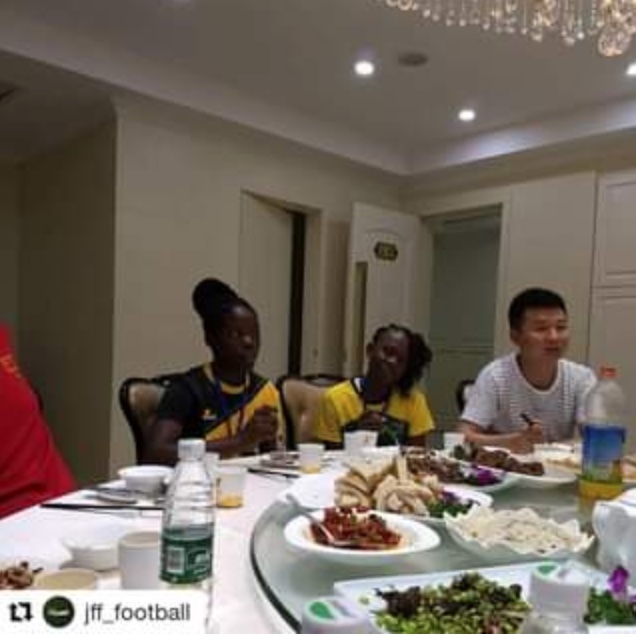
Where is `bowl`? The height and width of the screenshot is (638, 636). bowl is located at coordinates (137, 477).